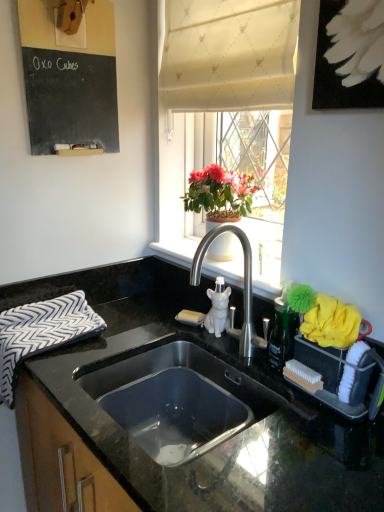
Question: Is black and white zigzag fabric hand towel at left at the right side of white textured curtain at upper center?

Choices:
 (A) yes
 (B) no

Answer: (B)

Question: Is black and white zigzag fabric hand towel at left taller than white textured curtain at upper center?

Choices:
 (A) no
 (B) yes

Answer: (A)

Question: From a real-world perspective, is black and white zigzag fabric hand towel at left positioned over white textured curtain at upper center based on gravity?

Choices:
 (A) no
 (B) yes

Answer: (A)

Question: Considering the relative sizes of black and white zigzag fabric hand towel at left and white textured curtain at upper center in the image provided, is black and white zigzag fabric hand towel at left thinner than white textured curtain at upper center?

Choices:
 (A) no
 (B) yes

Answer: (A)

Question: From the image's perspective, is black and white zigzag fabric hand towel at left on white textured curtain at upper center?

Choices:
 (A) no
 (B) yes

Answer: (A)

Question: Is black and white zigzag fabric hand towel at left behind white textured curtain at upper center?

Choices:
 (A) no
 (B) yes

Answer: (B)

Question: Is white ceramic window sill at upper center beside green leafy plant at upper center?

Choices:
 (A) no
 (B) yes

Answer: (A)

Question: From a real-world perspective, is white ceramic window sill at upper center on top of green leafy plant at upper center?

Choices:
 (A) no
 (B) yes

Answer: (A)

Question: From the image's perspective, is white ceramic window sill at upper center over green leafy plant at upper center?

Choices:
 (A) no
 (B) yes

Answer: (A)

Question: Does white ceramic window sill at upper center turn towards green leafy plant at upper center?

Choices:
 (A) no
 (B) yes

Answer: (A)

Question: Is white ceramic window sill at upper center positioned behind green leafy plant at upper center?

Choices:
 (A) yes
 (B) no

Answer: (B)

Question: Does white ceramic window sill at upper center lie in front of green leafy plant at upper center?

Choices:
 (A) no
 (B) yes

Answer: (B)

Question: Can you confirm if white fabric at upper center is shorter than black chalkboard at upper left?

Choices:
 (A) yes
 (B) no

Answer: (B)